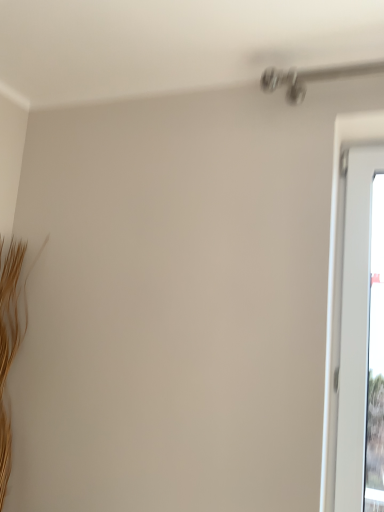
Question: Would you say transparent glass window at right is outside brown textured twig at left?

Choices:
 (A) no
 (B) yes

Answer: (B)

Question: Can you confirm if transparent glass window at right is smaller than brown textured twig at left?

Choices:
 (A) no
 (B) yes

Answer: (B)

Question: Would you say transparent glass window at right contains brown textured twig at left?

Choices:
 (A) no
 (B) yes

Answer: (A)

Question: Considering the relative positions of transparent glass window at right and brown textured twig at left in the image provided, is transparent glass window at right to the right of brown textured twig at left from the viewer's perspective?

Choices:
 (A) yes
 (B) no

Answer: (A)

Question: Is transparent glass window at right looking in the opposite direction of brown textured twig at left?

Choices:
 (A) no
 (B) yes

Answer: (A)

Question: From a real-world perspective, does transparent glass window at right sit lower than brown textured twig at left?

Choices:
 (A) no
 (B) yes

Answer: (A)

Question: Can you confirm if brown textured twig at left is positioned to the right of transparent glass window at right?

Choices:
 (A) no
 (B) yes

Answer: (A)

Question: Considering the relative sizes of brown textured twig at left and transparent glass window at right in the image provided, is brown textured twig at left shorter than transparent glass window at right?

Choices:
 (A) yes
 (B) no

Answer: (A)

Question: Is brown textured twig at left in front of transparent glass window at right?

Choices:
 (A) yes
 (B) no

Answer: (B)

Question: From a real-world perspective, is brown textured twig at left located higher than transparent glass window at right?

Choices:
 (A) no
 (B) yes

Answer: (A)

Question: Is transparent glass window at right surrounded by brown textured twig at left?

Choices:
 (A) no
 (B) yes

Answer: (A)

Question: From the image's perspective, is brown textured twig at left over transparent glass window at right?

Choices:
 (A) yes
 (B) no

Answer: (B)

Question: From a real-world perspective, is transparent glass window at right physically located above or below brown textured twig at left?

Choices:
 (A) above
 (B) below

Answer: (A)